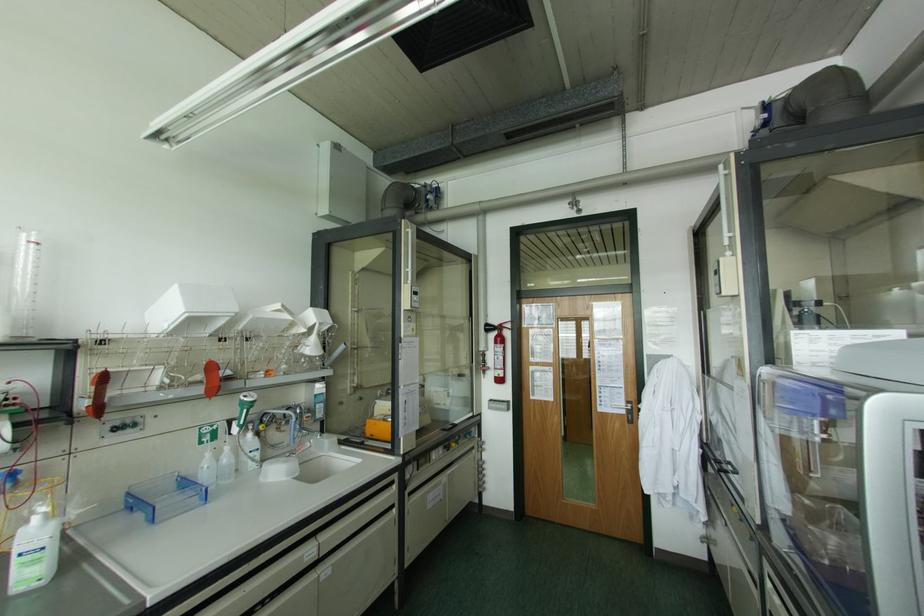
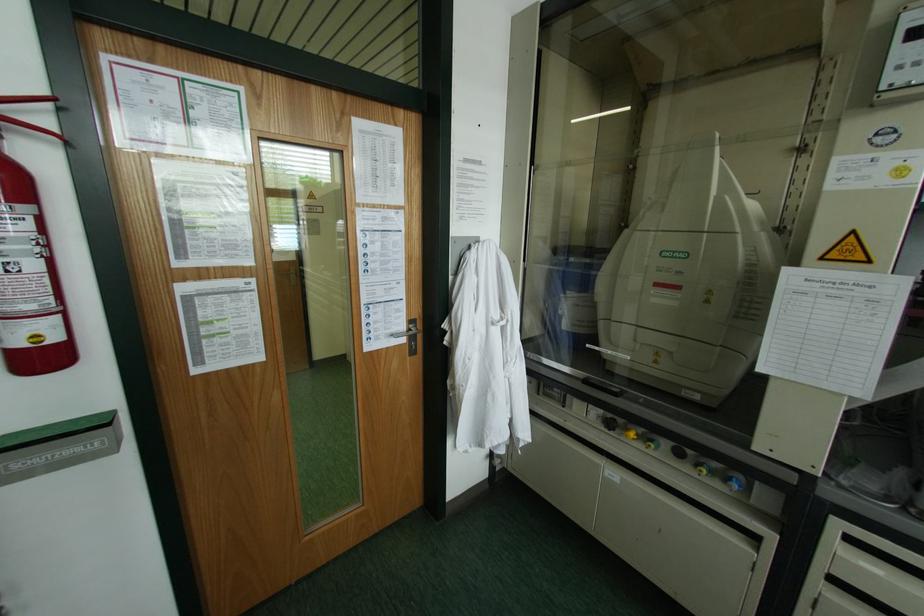
Locate, in the second image, the point that corresponds to [638,408] in the first image.

(444, 331)